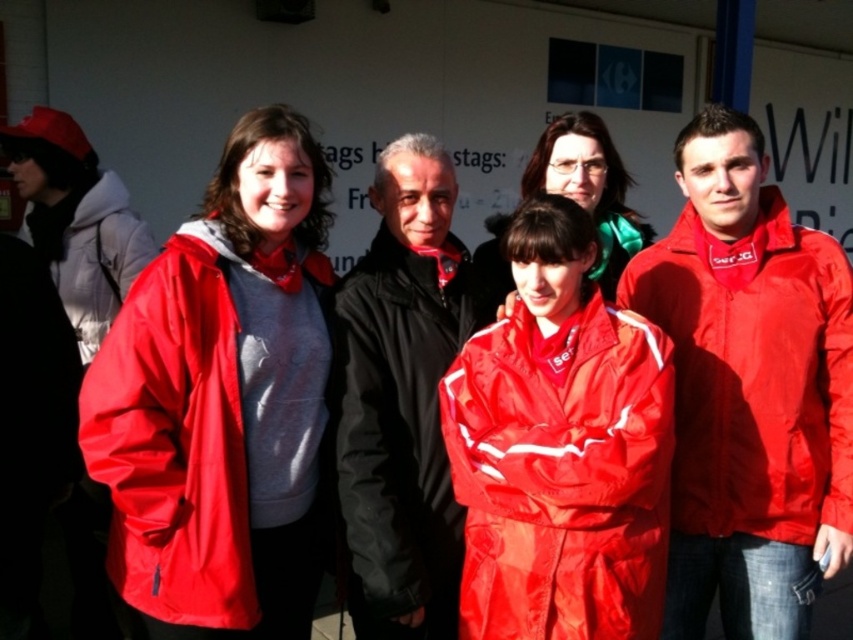
Locate an element on the screen. This screenshot has height=640, width=853. shiny red jacket at center is located at coordinates (561, 474).

Looking at this image, between shiny red jacket at center and matte nylon jacket at left, which one has more height?

Standing taller between the two is matte nylon jacket at left.

This screenshot has width=853, height=640. What are the coordinates of `shiny red jacket at center` in the screenshot? It's located at (561, 474).

Is point (727, 284) positioned after point (93, 195)?

No, it is in front of (93, 195).

Which is more to the left, matte red jacket at right or matte red jacket at left?

matte red jacket at left is more to the left.

Is point (762, 616) behind point (126, 205)?

No, (762, 616) is in front of (126, 205).

Where is `matte red jacket at right`? The image size is (853, 640). matte red jacket at right is located at coordinates (747, 387).

Which is below, shiny red jacket at center or matte red jacket at center?

shiny red jacket at center is below.

Is point (511, 602) less distant than point (486, 314)?

Yes, point (511, 602) is in front of point (486, 314).

Is point (451, 464) less distant than point (527, 161)?

Yes, it is.

Locate an element on the screen. shiny red jacket at center is located at coordinates (561, 474).